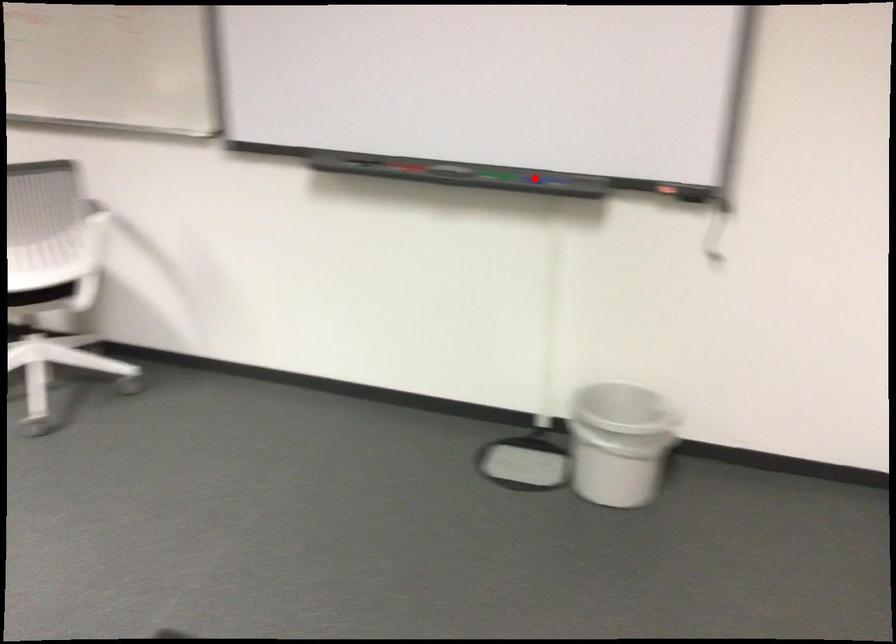
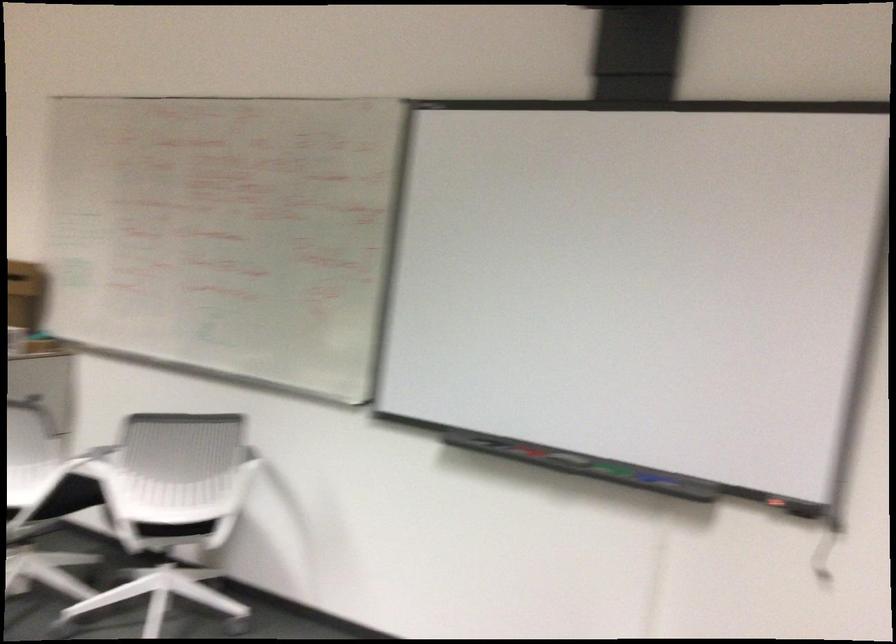
Locate, in the second image, the point that corresponds to the highlighted location in the first image.

(650, 478)